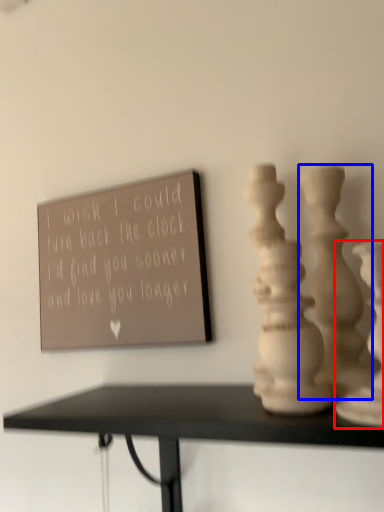
Question: Which object appears farthest to the camera in this image, vase (highlighted by a red box) or vase (highlighted by a blue box)?

Choices:
 (A) vase
 (B) vase

Answer: (B)